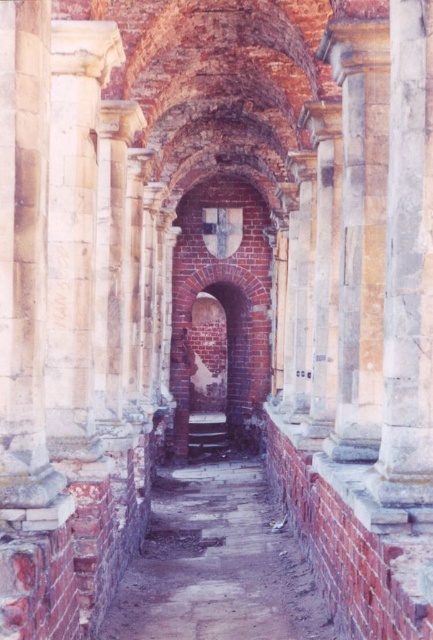
You are an archaeologist exploring the ancient corridor. You notice the brick alley at center and the smooth stone column at right. Which object is closer to your current position?

The smooth stone column at right is closer to you than the brick alley at center, so the smooth stone column at right is closer.

You are an architect examining the ruins of an ancient building. You notice the brick alley at center and the smooth stone column at right. Which structure has a lower height?

The brick alley at center has a lesser height compared to the smooth stone column at right, so the brick alley at center is shorter in height.

You are navigating through the ancient corridor and need to reach a point closer to you. There are two points marked in the corridor, point 1 at coordinates point (217, 548) and point 2 at coordinates point (400, 502). Which point should you head towards if you want to reach the one that is closer to your current position?

Point (217, 548) is further to the viewer than point (400, 502). Therefore, point (400, 502) is closer to your current position, so you should head towards point (400, 502).